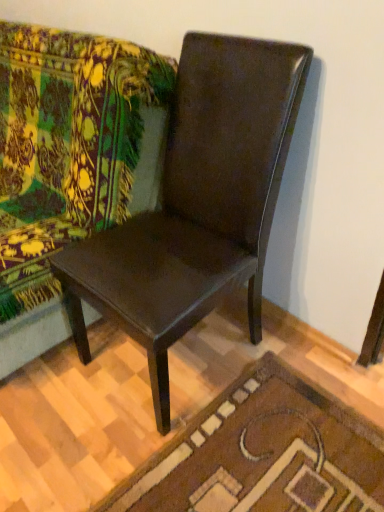
Question: Does brown textured rug at lower center have a lesser height compared to green floral fabric couch at upper left?

Choices:
 (A) no
 (B) yes

Answer: (B)

Question: Is brown textured rug at lower center placed right next to green floral fabric couch at upper left?

Choices:
 (A) yes
 (B) no

Answer: (B)

Question: Can you confirm if brown textured rug at lower center is smaller than green floral fabric couch at upper left?

Choices:
 (A) no
 (B) yes

Answer: (B)

Question: From the image's perspective, is brown textured rug at lower center under green floral fabric couch at upper left?

Choices:
 (A) no
 (B) yes

Answer: (B)

Question: From a real-world perspective, is brown textured rug at lower center physically below green floral fabric couch at upper left?

Choices:
 (A) yes
 (B) no

Answer: (A)

Question: Does brown textured rug at lower center appear on the left side of green floral fabric couch at upper left?

Choices:
 (A) yes
 (B) no

Answer: (B)

Question: Is glossy brown chair at center at the left side of green floral fabric couch at upper left?

Choices:
 (A) yes
 (B) no

Answer: (B)

Question: Is glossy brown chair at center smaller than green floral fabric couch at upper left?

Choices:
 (A) no
 (B) yes

Answer: (B)

Question: Is glossy brown chair at center positioned beyond the bounds of green floral fabric couch at upper left?

Choices:
 (A) yes
 (B) no

Answer: (A)

Question: From the image's perspective, is glossy brown chair at center located beneath green floral fabric couch at upper left?

Choices:
 (A) yes
 (B) no

Answer: (A)

Question: From a real-world perspective, is glossy brown chair at center physically below green floral fabric couch at upper left?

Choices:
 (A) yes
 (B) no

Answer: (B)

Question: Is green floral fabric couch at upper left inside glossy brown chair at center?

Choices:
 (A) no
 (B) yes

Answer: (A)

Question: Can you confirm if glossy brown chair at center is taller than brown textured rug at lower center?

Choices:
 (A) no
 (B) yes

Answer: (B)